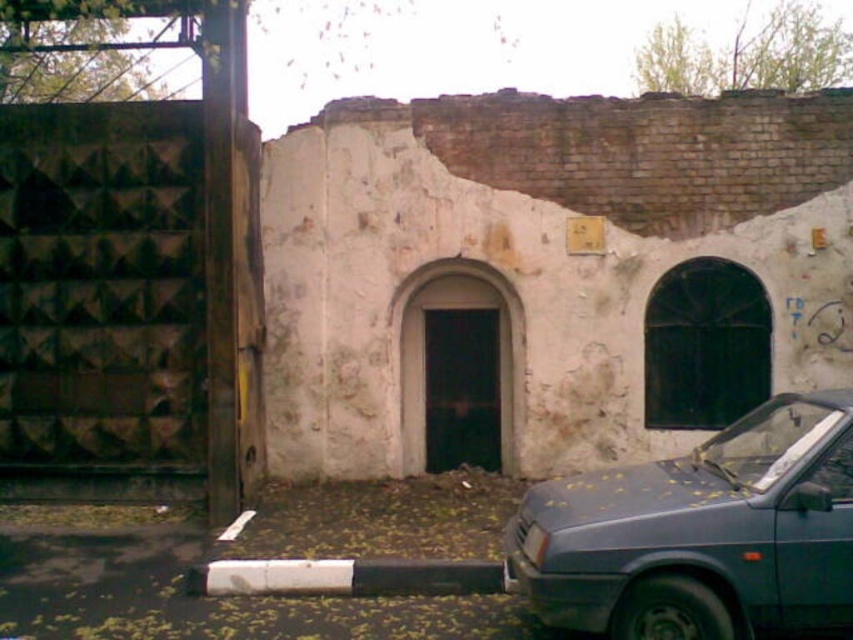
Question: Where is matte blue car at lower right located in relation to white plastic license plate at center in the image?

Choices:
 (A) right
 (B) left

Answer: (A)

Question: Which point is farther to the camera?

Choices:
 (A) white plastic license plate at center
 (B) matte blue car at lower right

Answer: (A)

Question: Can you confirm if matte blue car at lower right is wider than white plastic license plate at center?

Choices:
 (A) no
 (B) yes

Answer: (B)

Question: Is matte blue car at lower right below white plastic license plate at center?

Choices:
 (A) yes
 (B) no

Answer: (B)